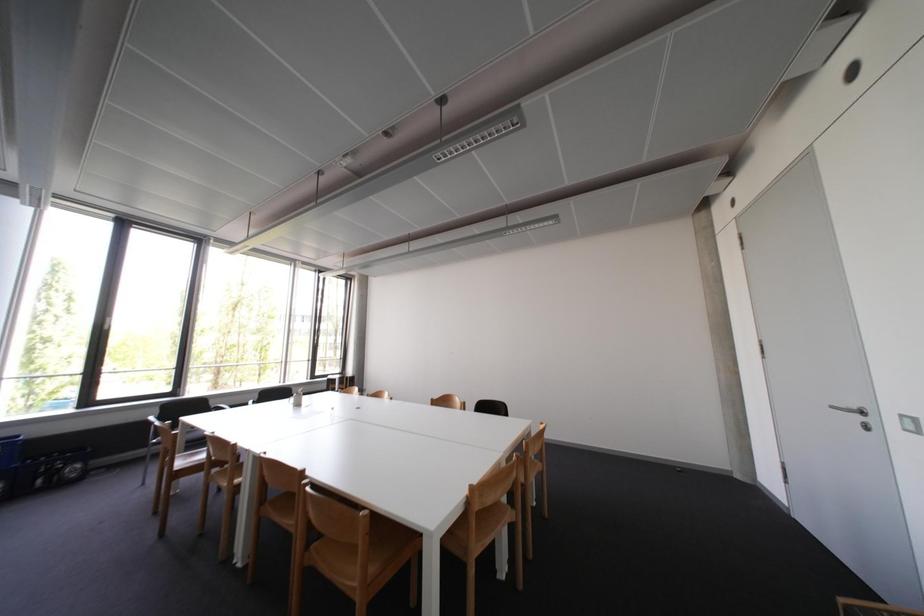
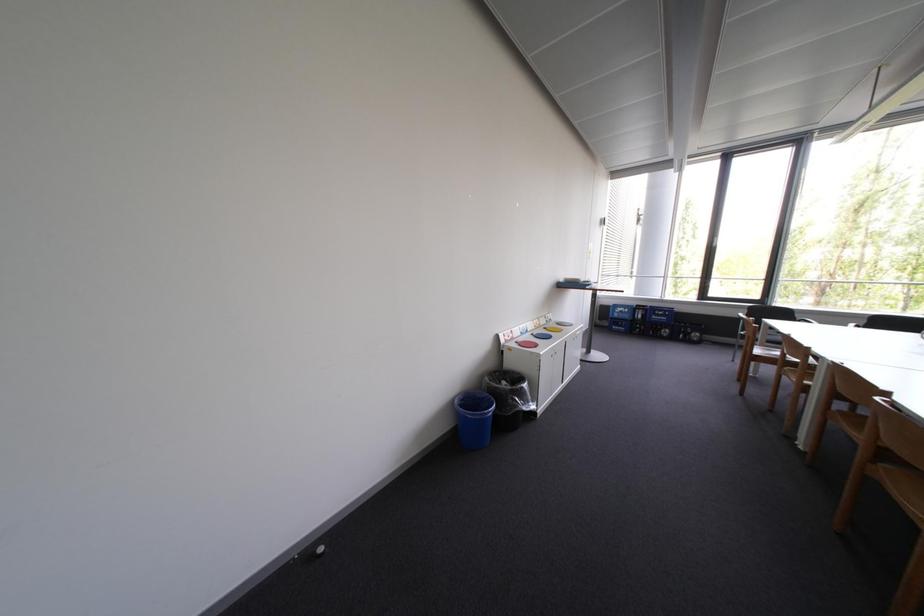
Question: The images are taken continuously from a first-person perspective. In which direction is your viewpoint rotating?

Choices:
 (A) Left
 (B) Right
 (C) Up
 (D) Down

Answer: (A)